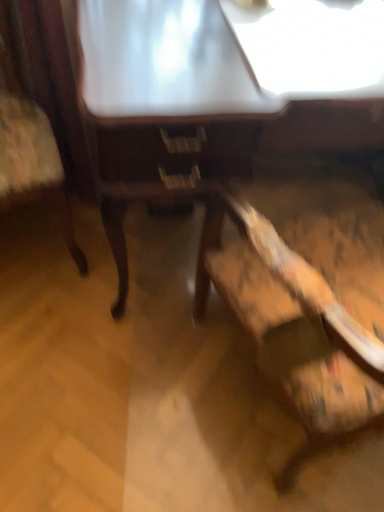
Locate an element on the screen. The image size is (384, 512). vacant space to the left of wooden chair at lower right, the 2th chair from the left is located at coordinates (119, 398).